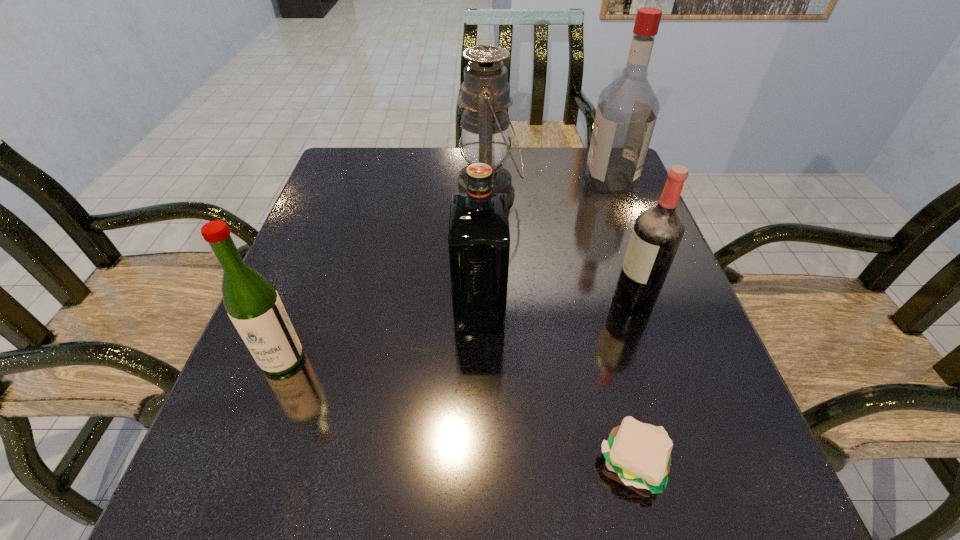
This screenshot has height=540, width=960. I want to click on vacant region that satisfies the following two spatial constraints: 1. on the front label of the third liquor from right to left; 2. on the label of the fifth farthest object, so click(x=479, y=359).

Identify the location of free space in the image that satisfies the following two spatial constraints: 1. on the front-facing side of the farthest liquor; 2. on the label of the leftmost liquor. This screenshot has height=540, width=960. (676, 359).

At what (x,y) coordinates should I click in order to perform the action: click on free spot that satisfies the following two spatial constraints: 1. on the label of the nearest object; 2. on the left side of the leftmost liquor. Please return your answer as a coordinate pair (x, y). Looking at the image, I should click on (243, 463).

I want to click on vacant area that satisfies the following two spatial constraints: 1. on the front-facing side of the farthest liquor; 2. on the front side of the oil lamp, so click(x=615, y=195).

This screenshot has width=960, height=540. I want to click on blank space that satisfies the following two spatial constraints: 1. on the front side of the oil lamp; 2. on the front label of the third liquor from right to left, so 491,308.